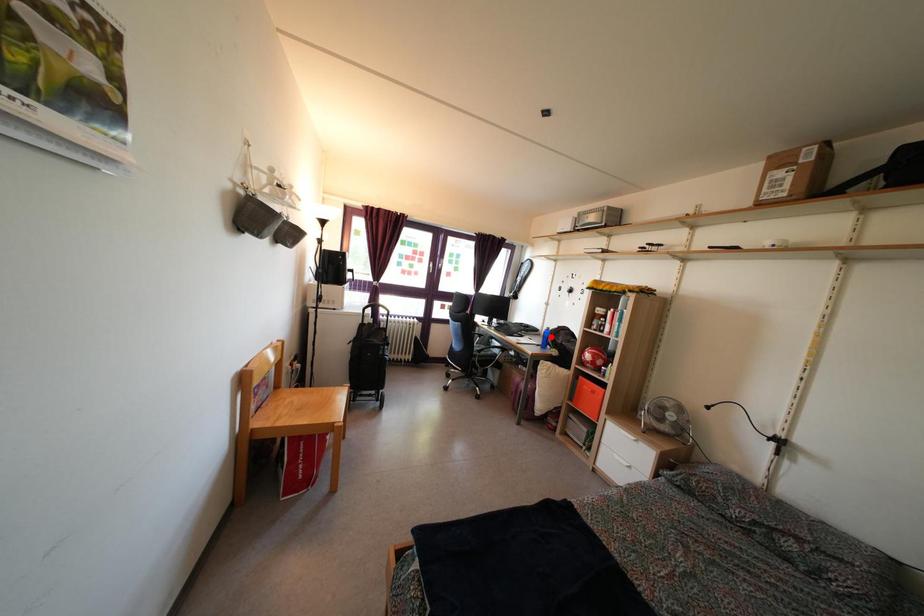
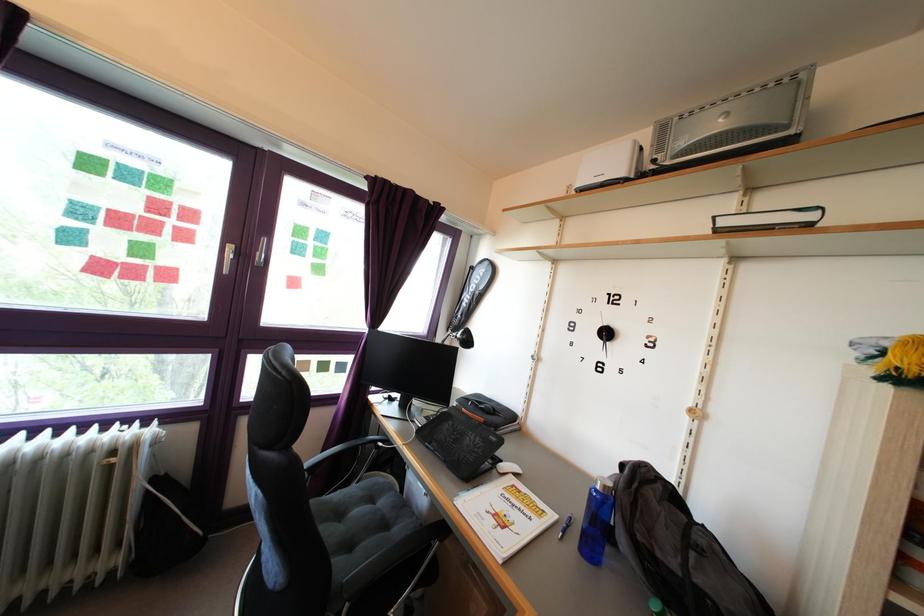
Question: A red point is marked in image1. In image2, is the corresponding 3D point closer to the camera or farther? Reply with the corresponding letter.

Choices:
 (A) The corresponding 3D point is closer.
 (B) The corresponding 3D point is farther.

Answer: (B)